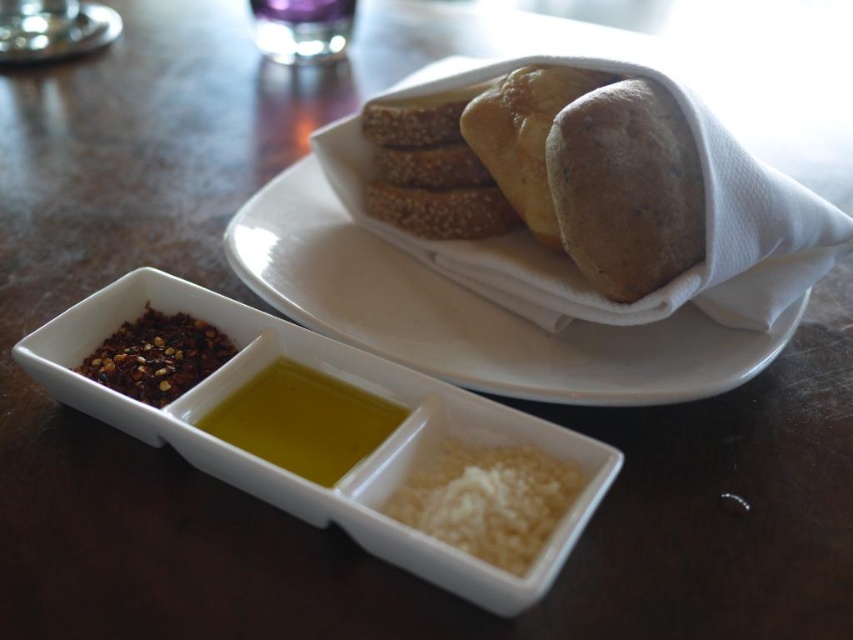
Is golden brown crusty bread at upper right wider than white crumbly cheese at lower center?

No.

Between point (659, 131) and point (447, 528), which one is positioned in front?

Positioned in front is point (447, 528).

Is point (578, 237) positioned after point (546, 499)?

That is True.

You are a GUI agent. You are given a task and a screenshot of the screen. Output one action in this format:
    pyautogui.click(x=<x>, y=<y>)
    Task: Click on the golden brown crusty bread at upper right
    The height and width of the screenshot is (640, 853).
    Given the screenshot: What is the action you would take?
    pyautogui.click(x=625, y=188)

Which of these two, sesame seed bread at upper center or yellow liquid oil at center, stands taller?

Standing taller between the two is sesame seed bread at upper center.

In the scene shown: Which is below, sesame seed bread at upper center or yellow liquid oil at center?

Positioned lower is yellow liquid oil at center.

The height and width of the screenshot is (640, 853). Identify the location of sesame seed bread at upper center. (469, 314).

Is yellow liquid oil at lower center bigger than yellow liquid oil at center?

Indeed, yellow liquid oil at lower center has a larger size compared to yellow liquid oil at center.

Image resolution: width=853 pixels, height=640 pixels. Identify the location of yellow liquid oil at lower center. (293, 474).